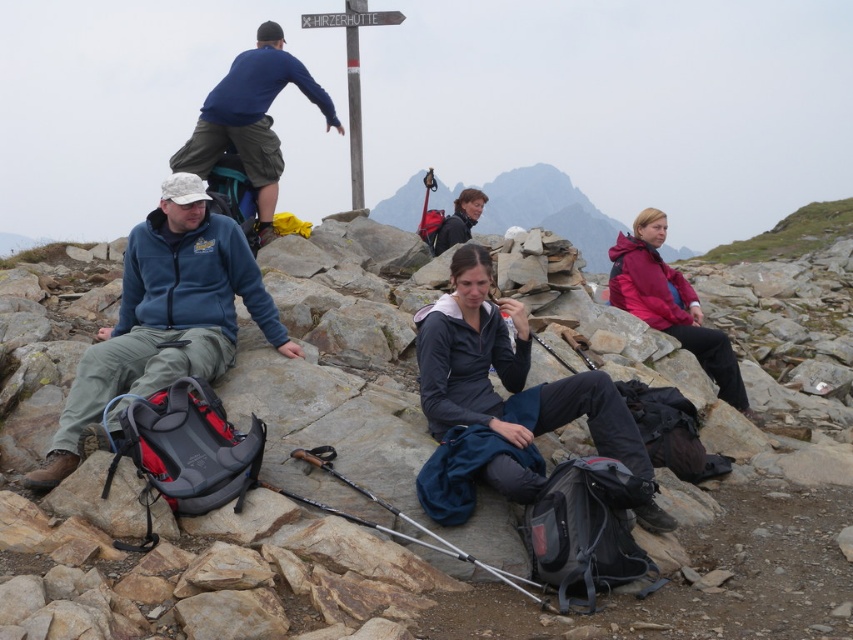
Question: Which point is closer to the camera taking this photo?

Choices:
 (A) (675, 275)
 (B) (595, 417)
 (C) (144, 262)

Answer: (B)

Question: Is matte black jacket at center thinner than blue cotton shirt at upper center?

Choices:
 (A) no
 (B) yes

Answer: (B)

Question: Is smooth gray rock at center in front of matte black jacket at center?

Choices:
 (A) yes
 (B) no

Answer: (A)

Question: Does rocky mountain at center appear under matte pink jacket at right?

Choices:
 (A) yes
 (B) no

Answer: (B)

Question: Which of these objects is positioned farthest from the rocky mountain at center?

Choices:
 (A) matte black jacket at center
 (B) blue fleece jacket at left

Answer: (A)

Question: Which object is the closest to the smooth gray rock at center?

Choices:
 (A) blue cotton shirt at upper center
 (B) blue fleece jacket at left

Answer: (B)